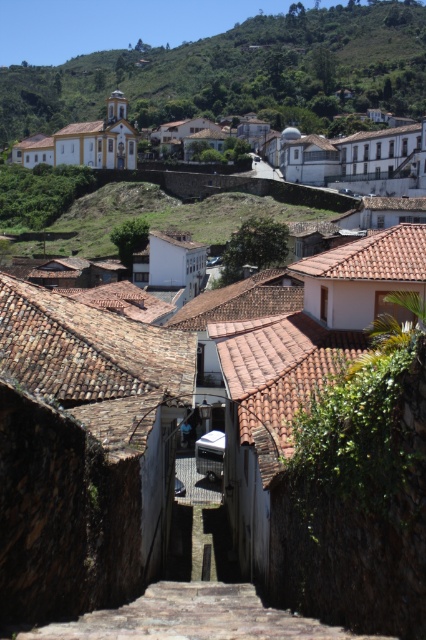
Question: Is green grassy hillside at upper center closer to the viewer compared to yellow painted church at upper left?

Choices:
 (A) yes
 (B) no

Answer: (A)

Question: Which of the following is the farthest from the observer?

Choices:
 (A) brown stone stairs at center
 (B) yellow painted church at upper left

Answer: (B)

Question: Does green leafy hillside at upper center appear under green grassy hillside at upper center?

Choices:
 (A) yes
 (B) no

Answer: (B)

Question: Which point is closer to the camera taking this photo?

Choices:
 (A) (359, 636)
 (B) (305, 205)

Answer: (A)

Question: Estimate the real-world distances between objects in this image. Which object is farther from the yellow painted church at upper left?

Choices:
 (A) green grassy hillside at upper center
 (B) green leafy hillside at upper center
 (C) brown stone stairs at center

Answer: (B)

Question: Is green leafy hillside at upper center wider than green grassy hillside at upper center?

Choices:
 (A) no
 (B) yes

Answer: (B)